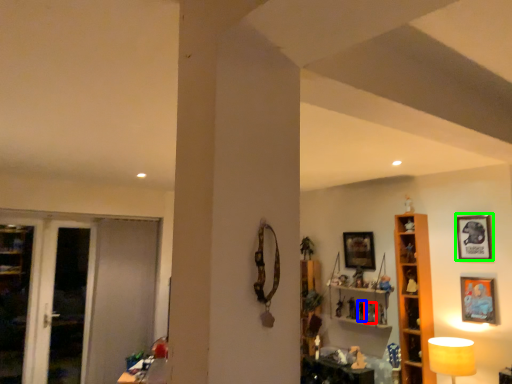
Question: Which is farther away from toy (highlighted by a red box)? toy (highlighted by a blue box) or picture frame (highlighted by a green box)?

Choices:
 (A) toy
 (B) picture frame

Answer: (B)